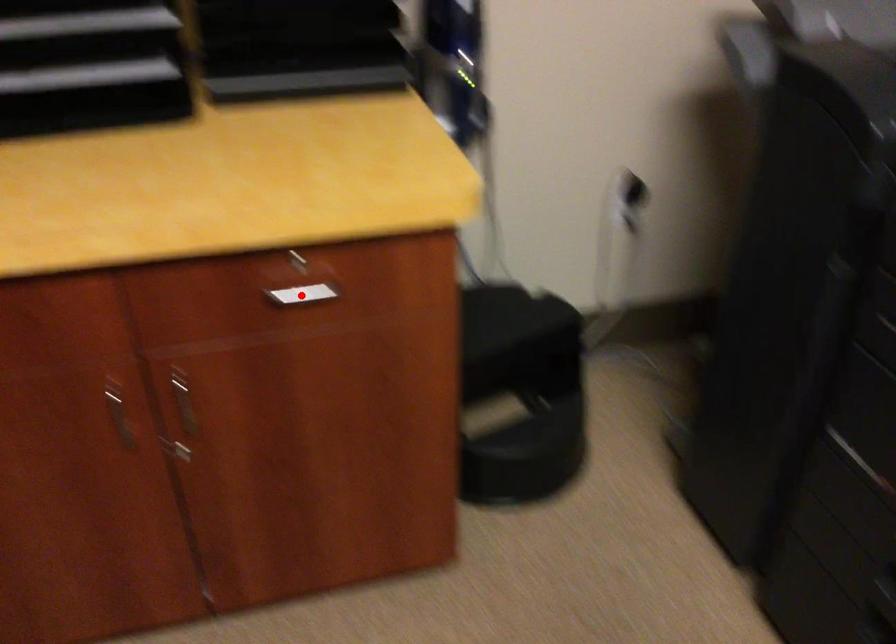
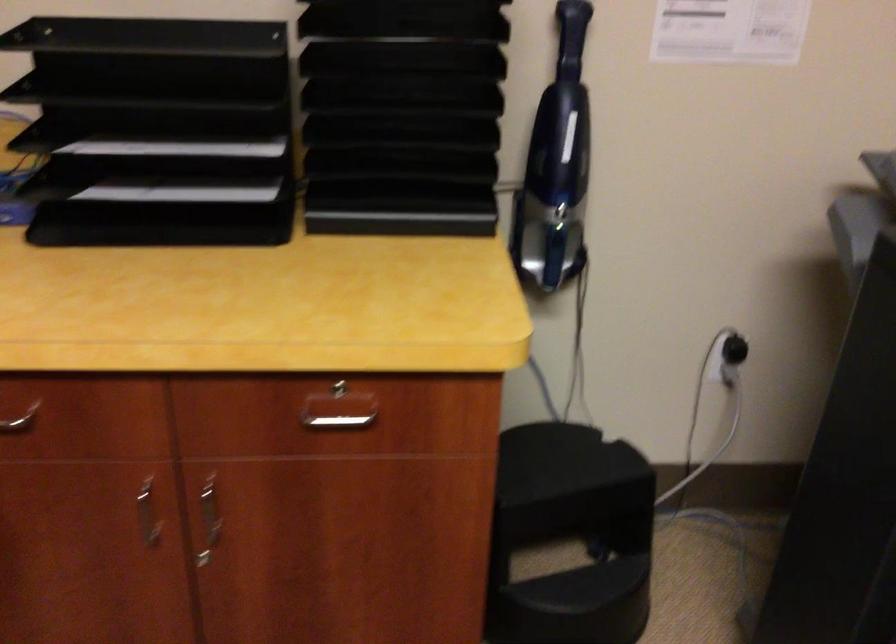
In the second image, find the point that corresponds to the highlighted location in the first image.

(338, 422)